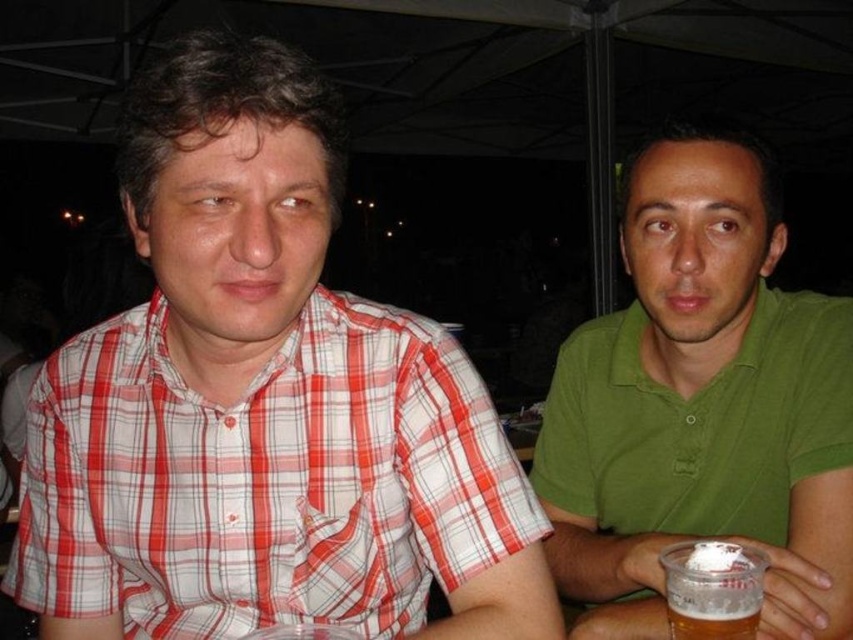
Question: Can you confirm if red plaid shirt at left is positioned to the left of translucent plastic cup at lower right?

Choices:
 (A) yes
 (B) no

Answer: (A)

Question: Among these points, which one is farthest from the camera?

Choices:
 (A) (701, 608)
 (B) (775, 353)
 (C) (224, 627)

Answer: (B)

Question: Which object appears farthest from the camera in this image?

Choices:
 (A) translucent plastic cup at lower right
 (B) green matte shirt at center

Answer: (B)

Question: Which of the following is the closest to the observer?

Choices:
 (A) (158, 618)
 (B) (683, 269)

Answer: (A)

Question: Is green matte shirt at center to the left of translucent plastic cup at lower right from the viewer's perspective?

Choices:
 (A) no
 (B) yes

Answer: (A)

Question: Is green matte shirt at center smaller than translucent plastic cup at lower right?

Choices:
 (A) no
 (B) yes

Answer: (A)